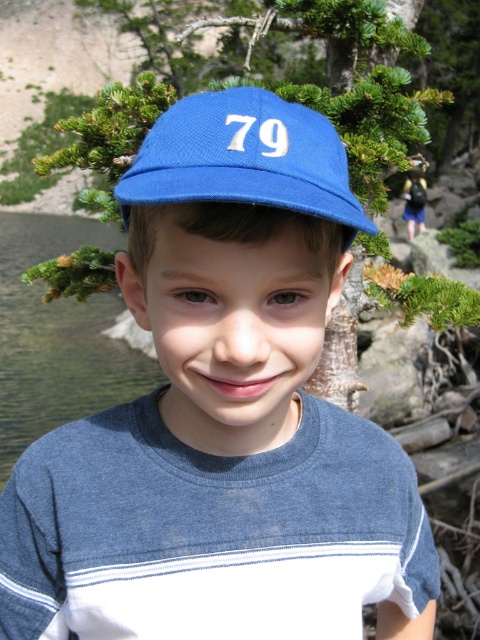
You are a hiker trying to decide where to set up your tent. You notice the green leafy branches at upper center and the clear water at lake left. Which area would provide more space for your tent? Explain your reasoning based on their sizes.

The clear water at lake left is larger in size than the green leafy branches at upper center, so it would provide more space for setting up your tent.

You are a photographer trying to capture a closeup of the blue fabric baseball cap at center while also including the green leafy branches at upper center in the frame. Given the distance between them, is it possible to fit both into a single photo without moving either object?

The green leafy branches at upper center and blue fabric baseball cap at center are 3.58 feet apart, so yes, it is possible to capture both in a single photo as they are within a reasonable distance for framing.

The green leafy branches at upper center are located at what coordinates?

The green leafy branches at upper center are located at coordinates point (360, 86).